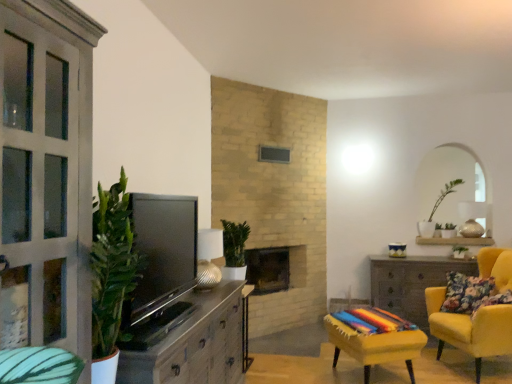
Question: Considering their positions, is wooden cabinet at left located in front of or behind floral fabric pillow at right?

Choices:
 (A) front
 (B) behind

Answer: (A)

Question: In terms of height, does wooden cabinet at left look taller or shorter compared to floral fabric pillow at right?

Choices:
 (A) tall
 (B) short

Answer: (A)

Question: Estimate the real-world distances between objects in this image. Which object is farther from the matte black tv at left?

Choices:
 (A) yellow fabric chair at right, positioned as the 1th chair in right-to-left order
 (B) wooden desk at right
 (C) green leafy plant at center-right
 (D) floral fabric pillow at right
 (E) wooden cabinet at left

Answer: (C)

Question: Estimate the real-world distances between objects in this image. Which object is farther from the green matte plant at upper right, the 1th houseplant in the back-to-front sequence?

Choices:
 (A) metallic ribbed lampshade at center
 (B) yellow fabric-covered chair at lower right, which is the 1th chair from left to right
 (C) wooden cabinet at left
 (D) wooden desk at right
 (E) green matte plant at center, the second houseplant in the back-to-front sequence

Answer: (C)